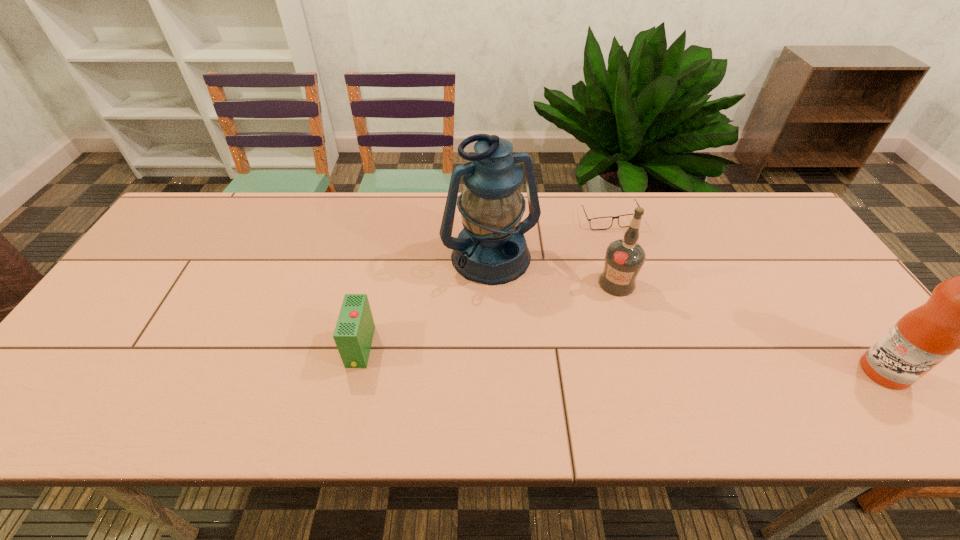
You are a GUI agent. You are given a task and a screenshot of the screen. Output one action in this format:
    pyautogui.click(x=<x>, y=<y>)
    Task: Click on the vacant space located 0.080m on the face of the lantern
    This screenshot has width=960, height=540.
    Given the screenshot: What is the action you would take?
    pyautogui.click(x=523, y=312)

This screenshot has width=960, height=540. I want to click on spectacles situated at the far edge, so click(601, 223).

You are a GUI agent. You are given a task and a screenshot of the screen. Output one action in this format:
    pyautogui.click(x=<x>, y=<y>)
    Task: Click on the lantern that is at the far edge
    
    Given the screenshot: What is the action you would take?
    point(491,249)

Identify the location of alarm clock at the near edge. (353, 335).

Where is `fruit juice at the near edge`? Image resolution: width=960 pixels, height=540 pixels. fruit juice at the near edge is located at coordinates (959, 313).

Find the location of a particular element. This screenshot has width=960, height=540. object positioned at the right edge is located at coordinates (959, 313).

This screenshot has height=540, width=960. I want to click on object that is at the near right corner, so click(959, 313).

Image resolution: width=960 pixels, height=540 pixels. I want to click on vacant area at the far edge, so click(x=526, y=213).

Identify the location of blank area at the near edge. The height and width of the screenshot is (540, 960). (339, 373).

The height and width of the screenshot is (540, 960). In order to click on free space at the left edge of the desktop in this screenshot , I will do `click(113, 342)`.